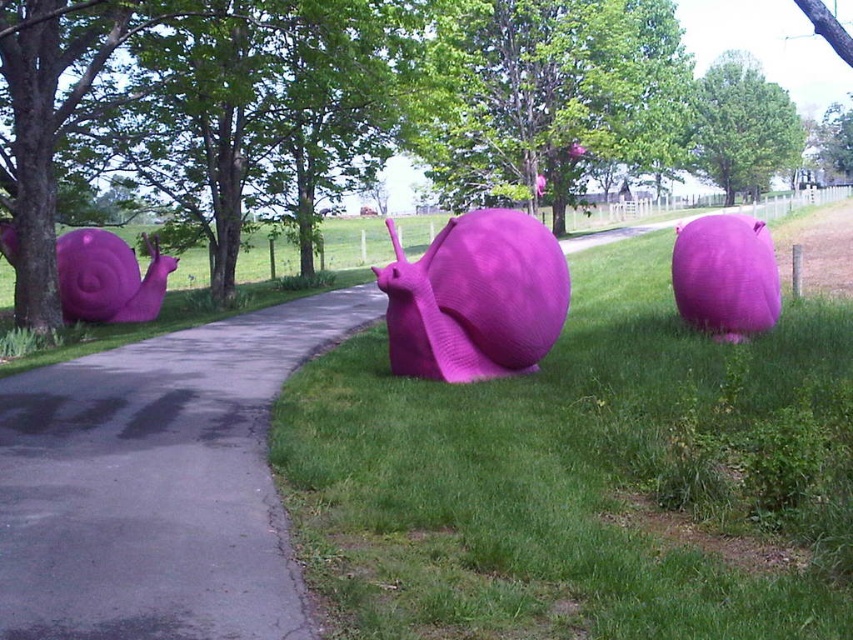
You are a photographer standing at the start of the pathway. You want to take a photo that includes both the purple matte snail at center and the asphalt at center. Which object should you focus on first to ensure both are in sharp focus?

The purple matte snail at center is closer to the viewer than the asphalt at center. To ensure both are in sharp focus, focus on the purple matte snail at center first, as it is closer, and the asphalt at center will naturally fall into focus behind it due to the depth of field.